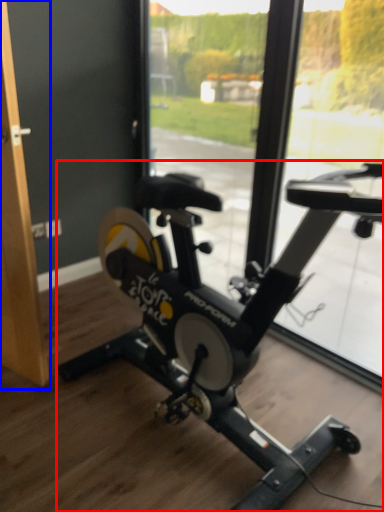
Question: Which object is closer to the camera taking this photo, stationary bicycle (highlighted by a red box) or screen door (highlighted by a blue box)?

Choices:
 (A) stationary bicycle
 (B) screen door

Answer: (A)